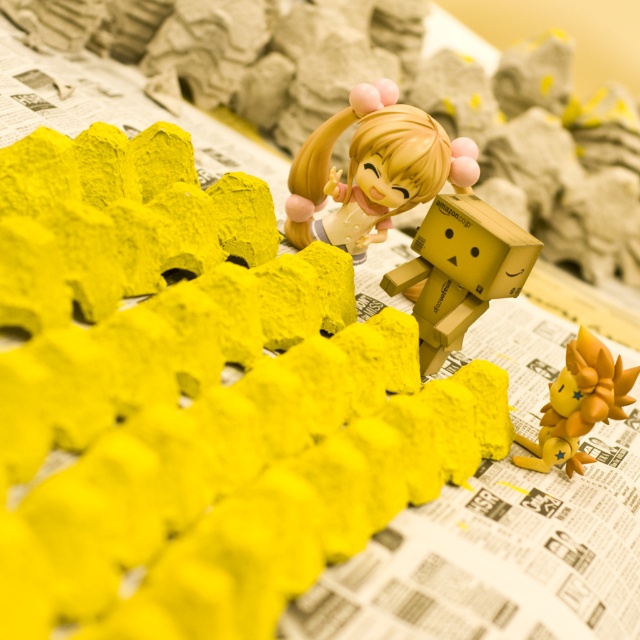
Which is below, smooth plastic doll at center or orange matte lion at lower right?

orange matte lion at lower right

Describe the element at coordinates (376, 163) in the screenshot. I see `smooth plastic doll at center` at that location.

Does point (385, 195) lie behind point (518, 435)?

That is True.

The width and height of the screenshot is (640, 640). What are the coordinates of `smooth plastic doll at center` in the screenshot? It's located at click(x=376, y=163).

Is wooden danbo at center positioned behind orange matte lion at lower right?

That is True.

Find the location of a particular element. wooden danbo at center is located at coordinates (460, 269).

Between point (444, 333) and point (593, 346), which one is positioned behind?

Positioned behind is point (444, 333).

I want to click on wooden danbo at center, so click(x=460, y=269).

Who is more distant from viewer, (288, 198) or (480, 204)?

The point (288, 198) is more distant.

Does point (292, 204) lie behind point (458, 237)?

That is True.

This screenshot has width=640, height=640. What do you see at coordinates (376, 163) in the screenshot?
I see `smooth plastic doll at center` at bounding box center [376, 163].

Where is `smooth plastic doll at center`? smooth plastic doll at center is located at coordinates (376, 163).